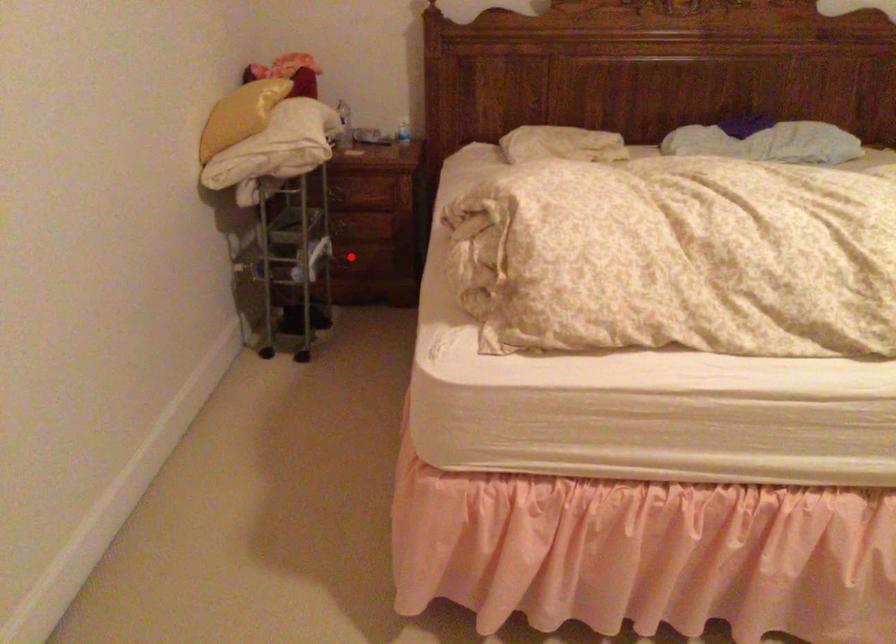
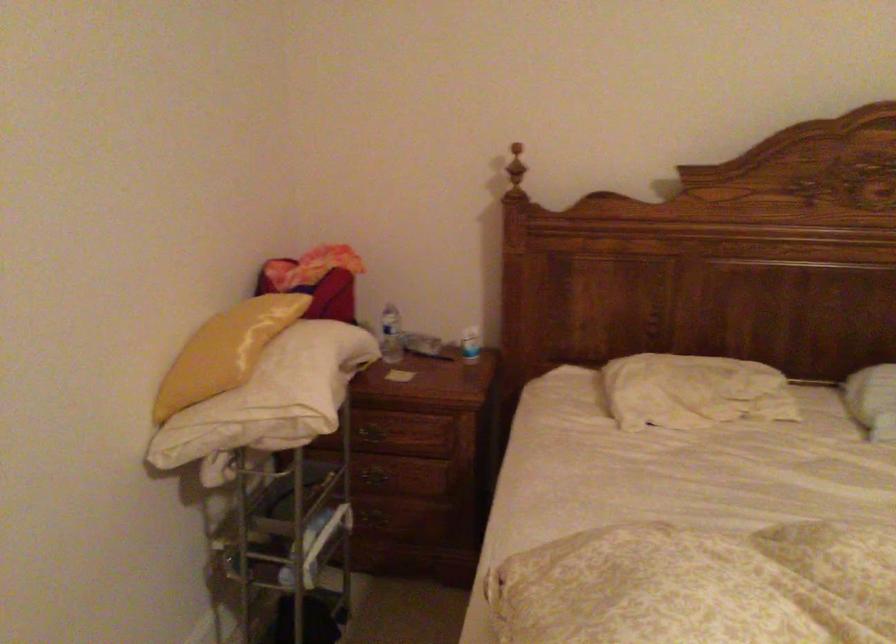
Question: I am providing you with two images of the same scene from different viewpoints. Given a red point in image1, look at the same physical point in image2. Is it:

Choices:
 (A) Closer to the viewpoint
 (B) Farther from the viewpoint

Answer: (A)